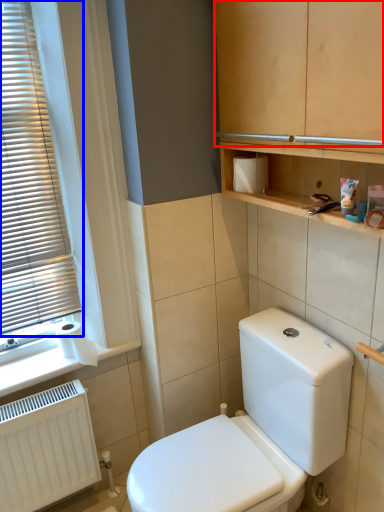
Question: Which object appears closest to the camera in this image, cabinetry (highlighted by a red box) or window blind (highlighted by a blue box)?

Choices:
 (A) cabinetry
 (B) window blind

Answer: (A)